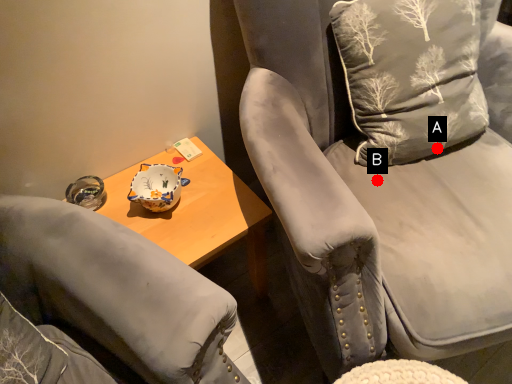
Question: Two points are circled on the image, labeled by A and B beside each circle. Which point is closer to the camera?

Choices:
 (A) A is closer
 (B) B is closer

Answer: (B)